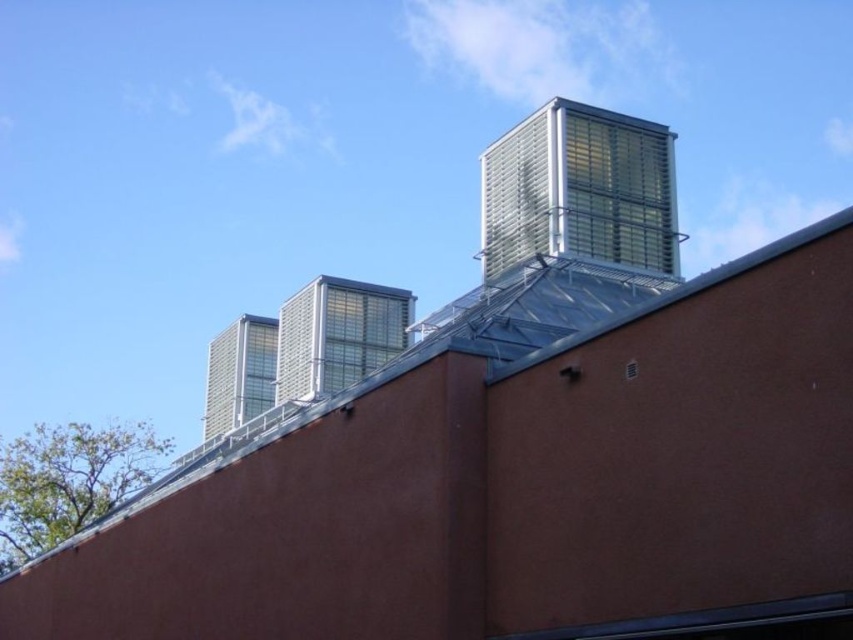
Question: Which of these objects is positioned farthest from the metallic grid tower at upper right?

Choices:
 (A) metallic silver vent at center
 (B) metallic grid structure at center

Answer: (A)

Question: Estimate the real-world distances between objects in this image. Which object is farther from the metallic silver vent at center?

Choices:
 (A) metallic grid structure at center
 (B) metallic grid tower at upper right

Answer: (B)

Question: Does metallic grid structure at center appear on the left side of metallic silver vent at center?

Choices:
 (A) yes
 (B) no

Answer: (B)

Question: From the image, what is the correct spatial relationship of metallic grid structure at center in relation to metallic silver vent at center?

Choices:
 (A) below
 (B) above

Answer: (B)

Question: Is metallic grid tower at upper right to the right of metallic silver vent at center from the viewer's perspective?

Choices:
 (A) yes
 (B) no

Answer: (A)

Question: Which point is farther from the camera taking this photo?

Choices:
 (A) coord(335,388)
 (B) coord(257,381)

Answer: (B)